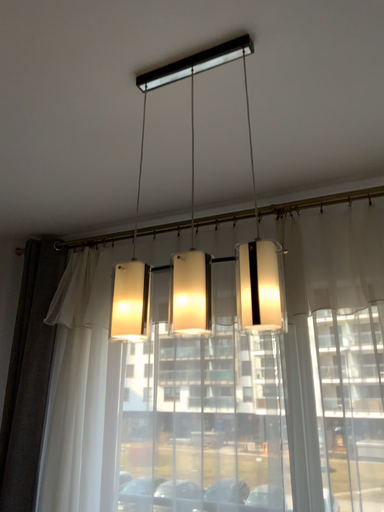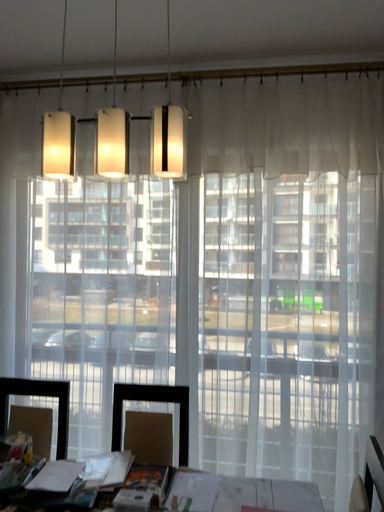
Question: Which way did the camera rotate in the video?

Choices:
 (A) rotated right
 (B) rotated left

Answer: (A)